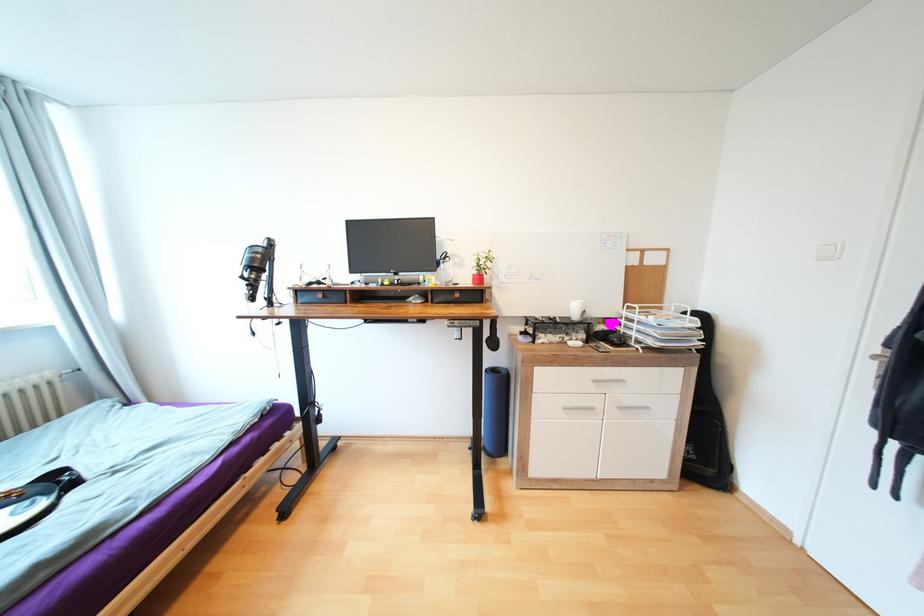
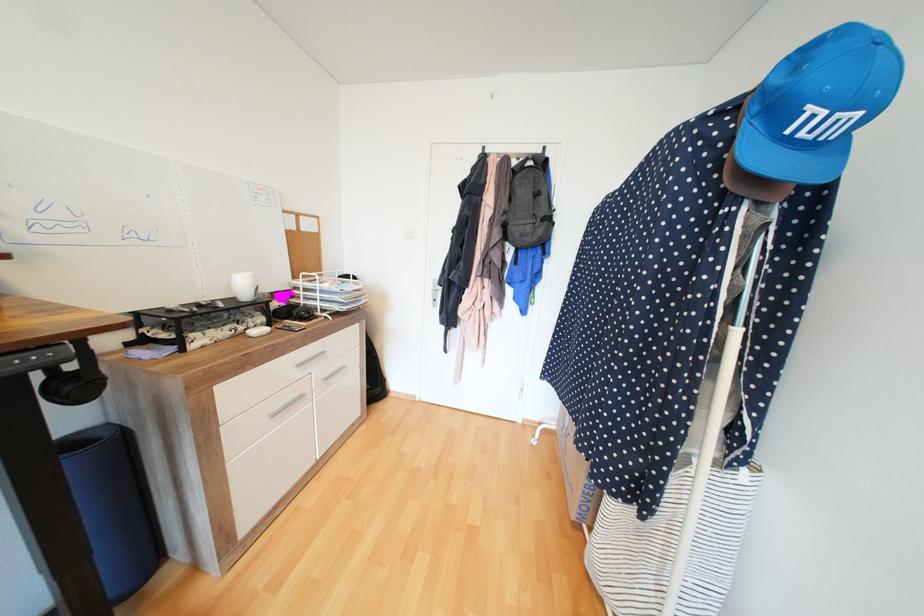
Find the pixel in the second image that matches (x=500, y=370) in the first image.

(80, 443)